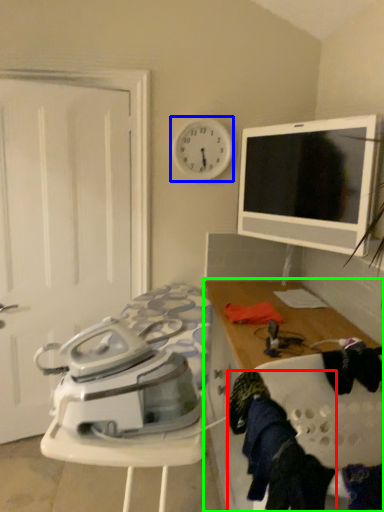
Question: Which object is positioned closest to clothing (highlighted by a red box)? Select from clock (highlighted by a blue box) and cabinetry (highlighted by a green box).

Choices:
 (A) clock
 (B) cabinetry

Answer: (B)